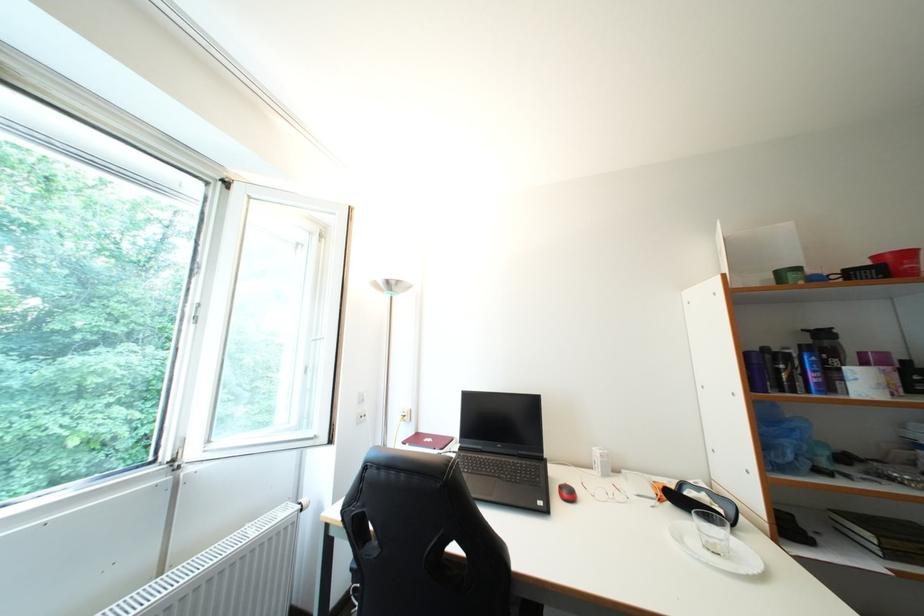
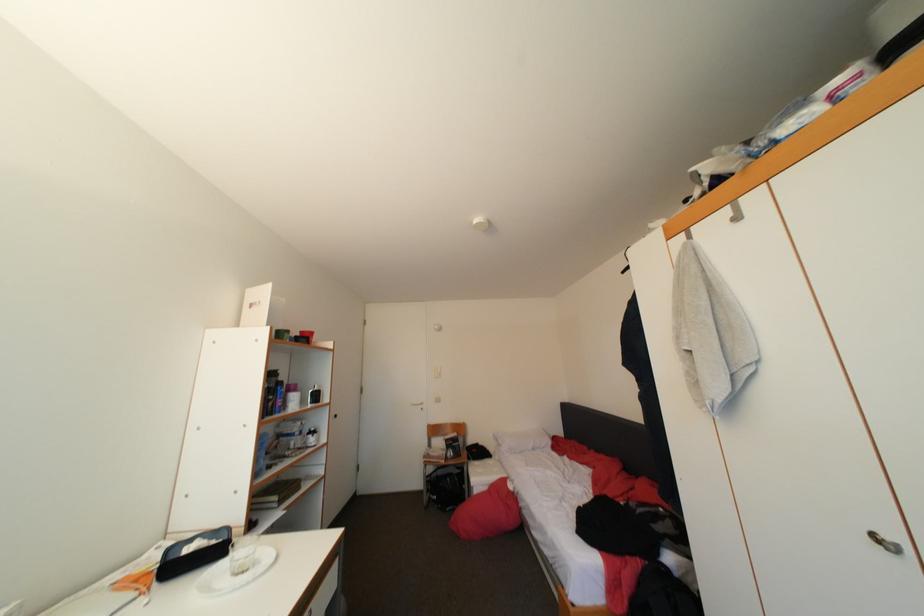
First-person continuous shooting, in which direction is the camera rotating?

The rotation direction of the camera is right-up.